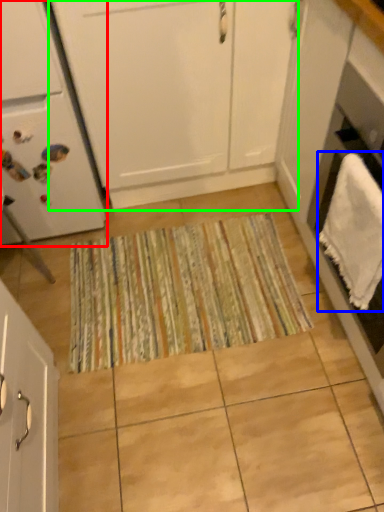
Question: Based on their relative distances, which object is nearer to home appliance (highlighted by a red box)? Choose from bath towel (highlighted by a blue box) and cabinetry (highlighted by a green box).

Choices:
 (A) bath towel
 (B) cabinetry

Answer: (B)